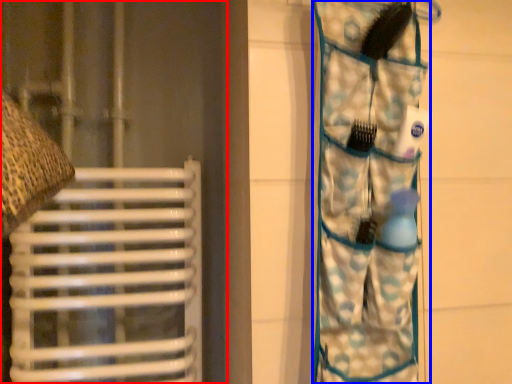
Question: Which object is closer to the camera taking this photo, curtain (highlighted by a red box) or camouflage (highlighted by a blue box)?

Choices:
 (A) curtain
 (B) camouflage

Answer: (B)